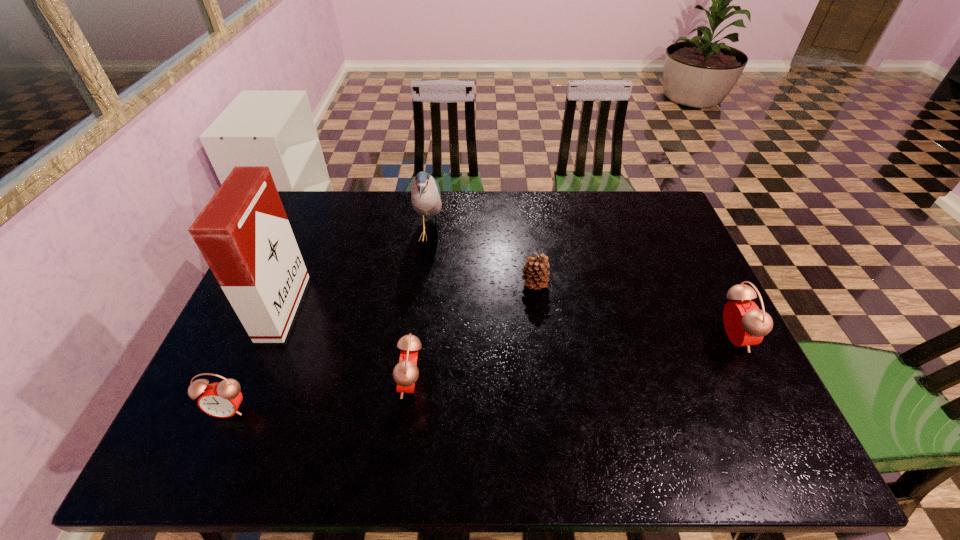
Find the location of a particular element. vacant space that is in between the rightmost object and the leftmost alarm clock is located at coordinates (480, 373).

The height and width of the screenshot is (540, 960). Find the location of `vacant area that lies between the rightmost alarm clock and the tallest object`. vacant area that lies between the rightmost alarm clock and the tallest object is located at coordinates (508, 322).

Find the location of a particular element. Image resolution: width=960 pixels, height=540 pixels. free spot between the second shortest alarm clock and the second object from right to left is located at coordinates (473, 334).

You are a GUI agent. You are given a task and a screenshot of the screen. Output one action in this format:
    pyautogui.click(x=<x>, y=<y>)
    Task: Click on the empty space between the shortest alarm clock and the rightmost alarm clock
    This screenshot has width=960, height=540.
    Given the screenshot: What is the action you would take?
    pyautogui.click(x=480, y=373)

The width and height of the screenshot is (960, 540). Identify the location of free point between the rightmost object and the pinecone. (634, 311).

What are the coordinates of `object that is the third closest one to the rightmost alarm clock` in the screenshot? It's located at (425, 196).

Locate an element on the screen. The width and height of the screenshot is (960, 540). object that is the third closest to the second object from right to left is located at coordinates (745, 325).

Choose which alarm clock is the third nearest neighbor to the cigarette_case. Please provide its 2D coordinates. Your answer should be formatted as a tuple, i.e. [(x, y)], where the tuple contains the x and y coordinates of a point satisfying the conditions above.

[(745, 325)]

You are a GUI agent. You are given a task and a screenshot of the screen. Output one action in this format:
    pyautogui.click(x=<x>, y=<y>)
    Task: Click on the alarm clock object that ranks as the closest to the farthest object
    
    Given the screenshot: What is the action you would take?
    pyautogui.click(x=405, y=373)

I want to click on free space that satisfies the following two spatial constraints: 1. at the tip of the second tallest object's beak; 2. on the clock face of the shortest alarm clock, so click(407, 409).